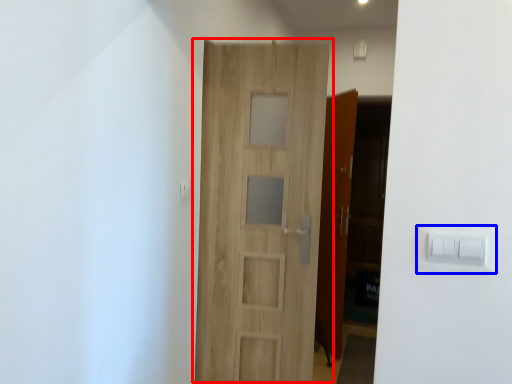
Question: Which point is closer to the camera, door (highlighted by a red box) or light switch (highlighted by a blue box)?

Choices:
 (A) door
 (B) light switch

Answer: (B)